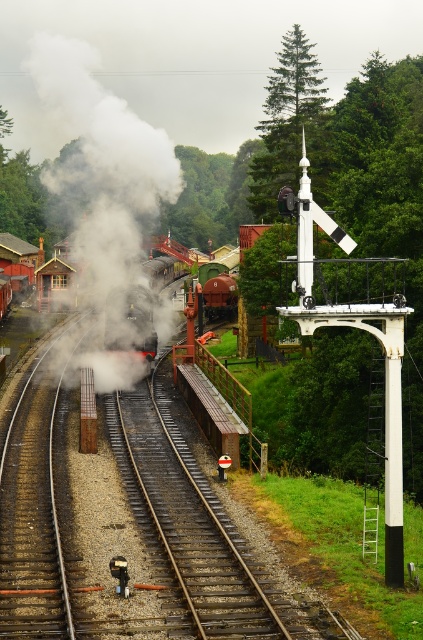
Between white matte steam at center and rusty metal train track at center, which one appears on the right side from the viewer's perspective?

rusty metal train track at center is more to the right.

Does white matte steam at center appear under rusty metal train track at center?

Incorrect, white matte steam at center is not positioned below rusty metal train track at center.

The height and width of the screenshot is (640, 423). Describe the element at coordinates (102, 163) in the screenshot. I see `white matte steam at center` at that location.

At what (x,y) coordinates should I click in order to perform the action: click on white matte steam at center. Please return your answer as a coordinate pair (x, y). This screenshot has width=423, height=640. Looking at the image, I should click on (102, 163).